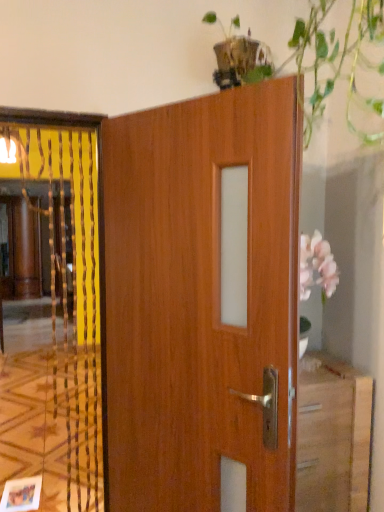
Question: Is wooden elevator at left inside the boundaries of wooden door at center, or outside?

Choices:
 (A) inside
 (B) outside

Answer: (B)

Question: Is point (31, 437) positioned closer to the camera than point (172, 203)?

Choices:
 (A) closer
 (B) farther

Answer: (B)

Question: Would you say wooden elevator at left is to the left or to the right of wooden door at center in the picture?

Choices:
 (A) left
 (B) right

Answer: (A)

Question: Considering the relative positions of wooden door at center and wooden elevator at left in the image provided, is wooden door at center to the left or to the right of wooden elevator at left?

Choices:
 (A) right
 (B) left

Answer: (A)

Question: Is point (183, 431) positioned closer to the camera than point (11, 450)?

Choices:
 (A) closer
 (B) farther

Answer: (A)

Question: From the image's perspective, is wooden door at center above or below wooden elevator at left?

Choices:
 (A) below
 (B) above

Answer: (A)

Question: Considering their positions, is wooden door at center located in front of or behind wooden elevator at left?

Choices:
 (A) front
 (B) behind

Answer: (A)